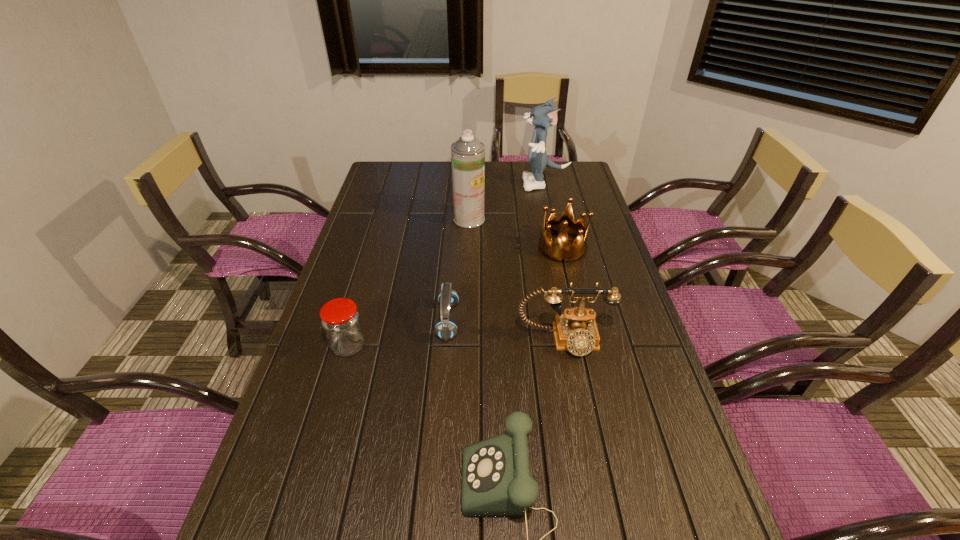
Identify the location of the farthest object. The height and width of the screenshot is (540, 960). pos(543,116).

Image resolution: width=960 pixels, height=540 pixels. Identify the location of aerosol can. (467, 154).

I want to click on the farther telephone, so click(576, 330).

Identify the location of crown. The height and width of the screenshot is (540, 960). (x=560, y=250).

The width and height of the screenshot is (960, 540). What are the coordinates of `jar` in the screenshot? It's located at (340, 319).

Identify the location of headset. The width and height of the screenshot is (960, 540). (445, 329).

This screenshot has height=540, width=960. In order to click on vacant space located 0.100m on the front-facing side of the cat in this screenshot , I will do `click(497, 184)`.

You are a GUI agent. You are given a task and a screenshot of the screen. Output one action in this format:
    pyautogui.click(x=<x>, y=<y>)
    Task: Click on the vacant space located 0.330m on the front-facing side of the cat
    The image size is (960, 540).
    Given the screenshot: What is the action you would take?
    pyautogui.click(x=442, y=184)

I want to click on vacant region located 0.070m on the front-facing side of the cat, so click(505, 184).

Find the location of a particular element. blank space located on the back of the sixth nearest object is located at coordinates (470, 190).